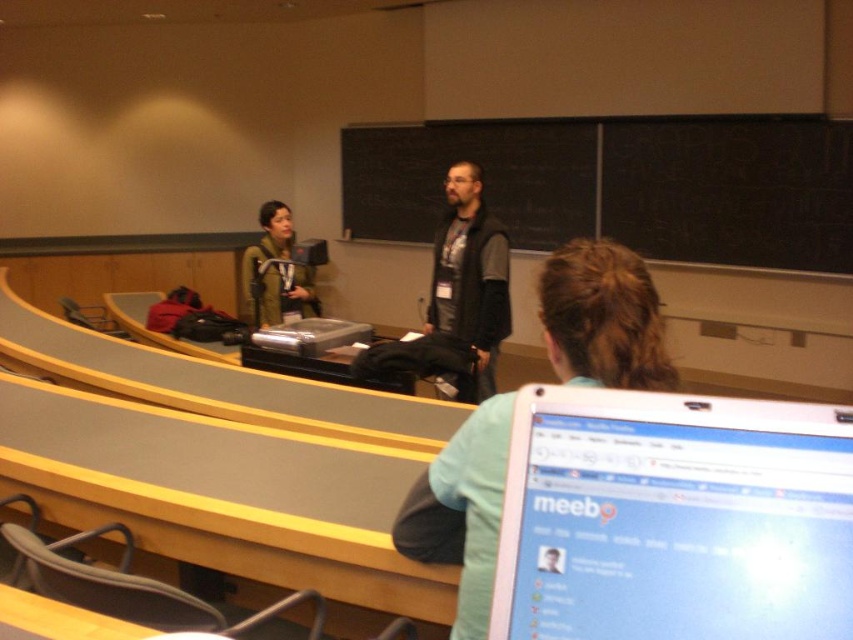
Question: Can you confirm if white glossy laptop at lower right is bigger than green matte jacket at center?

Choices:
 (A) no
 (B) yes

Answer: (A)

Question: Which of these objects is positioned closest to the dark gray vest at center?

Choices:
 (A) dark gray jacket at center
 (B) matte black laptop at center
 (C) green matte jacket at center
 (D) white glossy laptop at lower right

Answer: (B)

Question: Where is dark gray jacket at center located in relation to green matte jacket at center in the image?

Choices:
 (A) right
 (B) left

Answer: (A)

Question: Which object appears closest to the camera in this image?

Choices:
 (A) green matte jacket at center
 (B) white glossy laptop at lower right
 (C) matte black laptop at center

Answer: (B)

Question: Is white glossy laptop at lower right below dark gray jacket at center?

Choices:
 (A) no
 (B) yes

Answer: (A)

Question: Which point is closer to the camera?

Choices:
 (A) (450, 436)
 (B) (741, 406)

Answer: (B)